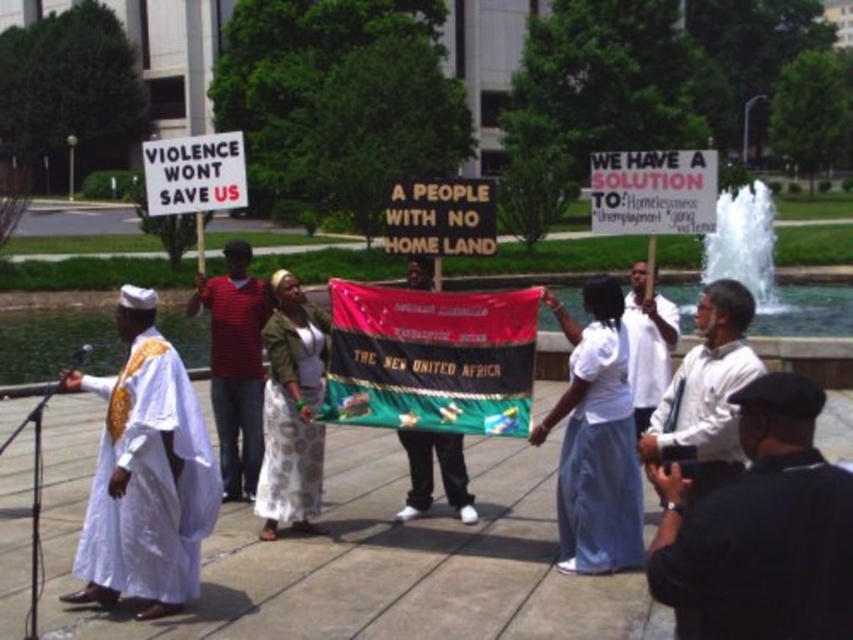
Question: Which point is closer to the camera?

Choices:
 (A) white textured dress at center
 (B) white cotton dress at center
 (C) white matte robe at center

Answer: (B)

Question: Among these objects, which one is nearest to the camera?

Choices:
 (A) white matte robe at center
 (B) white cotton dress at center
 (C) white stone fountain at right
 (D) black fabric camera at lower right

Answer: (D)

Question: Does white satin robe at left have a lesser width compared to white shirt at center?

Choices:
 (A) yes
 (B) no

Answer: (B)

Question: Does white cotton dress at center appear over white matte robe at center?

Choices:
 (A) no
 (B) yes

Answer: (A)

Question: Does white satin robe at center have a lesser width compared to white stone fountain at right?

Choices:
 (A) no
 (B) yes

Answer: (B)

Question: Which point is closer to the camera taking this photo?

Choices:
 (A) (732, 276)
 (B) (844, 593)
 (C) (310, 426)

Answer: (B)